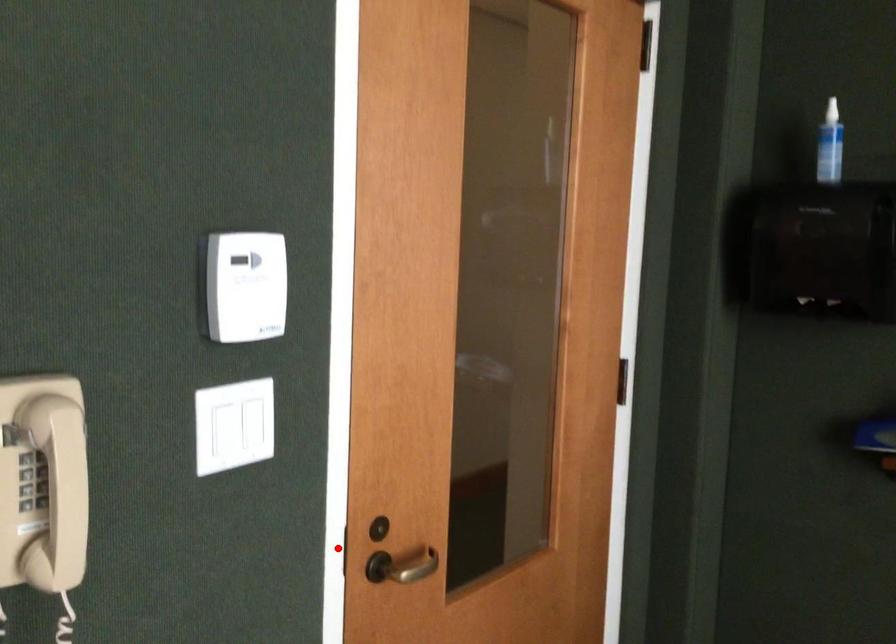
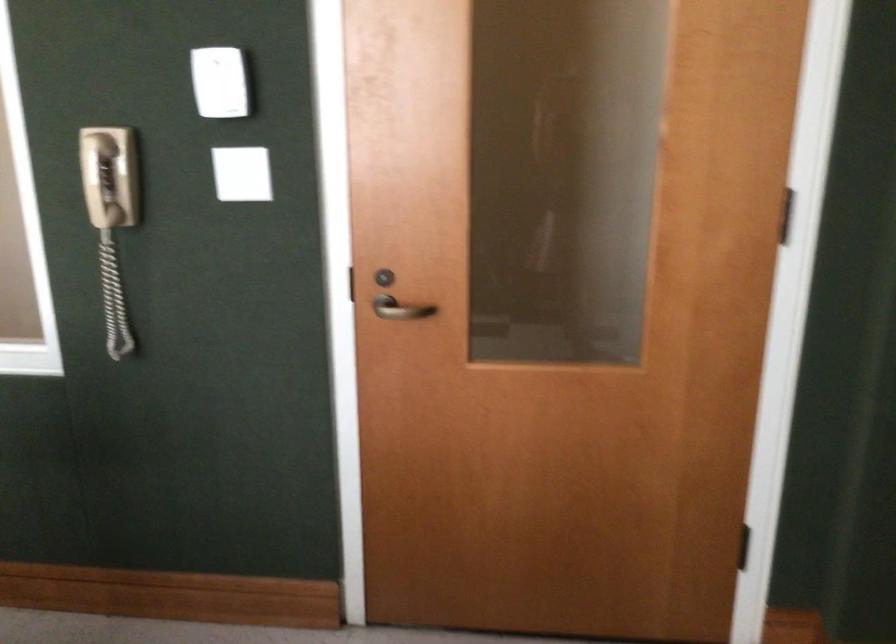
In the second image, find the point that corresponds to the highlighted location in the first image.

(346, 283)